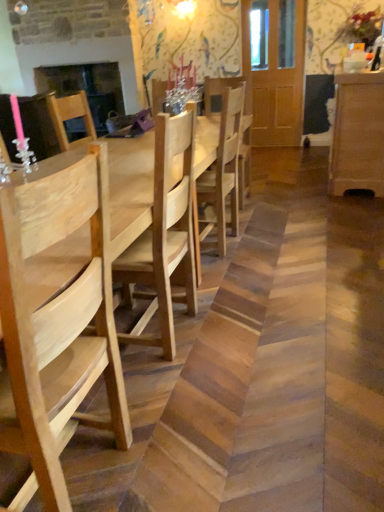
This screenshot has width=384, height=512. Describe the element at coordinates (224, 169) in the screenshot. I see `natural wood chair at center, arranged as the second chair when viewed from the left` at that location.

Image resolution: width=384 pixels, height=512 pixels. Describe the element at coordinates (86, 88) in the screenshot. I see `matte black fireplace at upper left` at that location.

Find the location of a particular element. natural wood chair at center, marked as the 1th chair in a front-to-back arrangement is located at coordinates (57, 326).

In order to click on natural wood table at center in this screenshot , I will do [130, 189].

The width and height of the screenshot is (384, 512). What do you see at coordinates (130, 189) in the screenshot? I see `natural wood table at center` at bounding box center [130, 189].

Where is `light brown wood dresser at right`? This screenshot has width=384, height=512. light brown wood dresser at right is located at coordinates (357, 134).

From the image's perspective, which one is positioned higher, light brown wood dresser at right or natural wood table at center?

light brown wood dresser at right is shown above in the image.

How many degrees apart are the facing directions of light brown wood dresser at right and natural wood table at center?

They differ by 0.306 degrees in their facing directions.

Are light brown wood dresser at right and natural wood table at center located far from each other?

Yes, light brown wood dresser at right is far from natural wood table at center.

Is light brown wood dresser at right in front of or behind natural wood table at center in the image?

Clearly, light brown wood dresser at right is behind natural wood table at center.

Looking at this image, from the image's perspective, which object appears higher, natural wood chair at center, marked as the 1th chair in a front-to-back arrangement, or light brown wood dresser at right?

light brown wood dresser at right is shown above in the image.

Is point (56, 431) behind point (358, 80)?

That is False.

Considering the positions of objects natural wood chair at center, the 2th chair when ordered from right to left, and light brown wood dresser at right in the image provided, who is more to the left, natural wood chair at center, the 2th chair when ordered from right to left, or light brown wood dresser at right?

From the viewer's perspective, natural wood chair at center, the 2th chair when ordered from right to left, appears more on the left side.

Between natural wood chair at center, the 2th chair when ordered from right to left, and light brown wood dresser at right, which one has larger size?

With larger size is light brown wood dresser at right.

Can you confirm if light brown wood dresser at right is wider than matte black fireplace at upper left?

→ Yes.

Consider the image. From the image's perspective, which is above, light brown wood dresser at right or matte black fireplace at upper left?

matte black fireplace at upper left.

Is light brown wood dresser at right aimed at matte black fireplace at upper left?

Yes, light brown wood dresser at right faces towards matte black fireplace at upper left.

Is light brown wood dresser at right in contact with matte black fireplace at upper left?

No, light brown wood dresser at right is not in contact with matte black fireplace at upper left.

Consider the image. Which of these two, natural wood chair at center, arranged as the second chair when viewed from the left, or natural wood table at center, stands taller?

Standing taller between the two is natural wood chair at center, arranged as the second chair when viewed from the left.

How many degrees apart are the facing directions of natural wood chair at center, arranged as the second chair when viewed from the left, and natural wood table at center?

natural wood chair at center, arranged as the second chair when viewed from the left, and natural wood table at center are facing 3.71 degrees away from each other.

Locate an element on the screen. table located below the natural wood chair at center, marked as the 1th chair in a back-to-front arrangement (from the image's perspective) is located at coordinates (130, 189).

Are natural wood chair at center, marked as the 1th chair in a back-to-front arrangement, and natural wood table at center far apart?

No, natural wood chair at center, marked as the 1th chair in a back-to-front arrangement, is not far from natural wood table at center.

Which object is wider, matte black fireplace at upper left or natural wood chair at center, arranged as the 1th chair when viewed from the left?

natural wood chair at center, arranged as the 1th chair when viewed from the left.

Who is taller, matte black fireplace at upper left or natural wood chair at center, arranged as the 1th chair when viewed from the left?

Standing taller between the two is matte black fireplace at upper left.

Does matte black fireplace at upper left appear on the left side of natural wood chair at center, arranged as the 1th chair when viewed from the left?

Yes, matte black fireplace at upper left is to the left of natural wood chair at center, arranged as the 1th chair when viewed from the left.

Can you tell me how much matte black fireplace at upper left and natural wood chair at center, the 2th chair when ordered from right to left, differ in facing direction?

matte black fireplace at upper left and natural wood chair at center, the 2th chair when ordered from right to left, are facing 94.2 degrees away from each other.

Consider the image. Who is bigger, matte black fireplace at upper left or light brown wood dresser at right?

With larger size is light brown wood dresser at right.

From a real-world perspective, is matte black fireplace at upper left positioned under light brown wood dresser at right based on gravity?

No.

Considering the relative sizes of matte black fireplace at upper left and light brown wood dresser at right in the image provided, is matte black fireplace at upper left thinner than light brown wood dresser at right?

Indeed, matte black fireplace at upper left has a lesser width compared to light brown wood dresser at right.

This screenshot has width=384, height=512. In the image, there is a matte black fireplace at upper left. Identify the location of table below it (from the image's perspective). (130, 189).

Looking at this image, can you confirm if natural wood table at center is shorter than matte black fireplace at upper left?

Yes.

Can you confirm if natural wood table at center is bigger than matte black fireplace at upper left?

Yes.

At what (x,y) coordinates should I click in order to perform the action: click on table located underneath the light brown wood dresser at right (from a real-world perspective). Please return your answer as a coordinate pair (x, y). This screenshot has height=512, width=384. Looking at the image, I should click on (130, 189).

At what (x,y) coordinates should I click in order to perform the action: click on chair that is the 2nd one when counting downward from the light brown wood dresser at right (from the image's perspective). Please return your answer as a coordinate pair (x, y). Looking at the image, I should click on (57, 326).

Looking at the image, which one is located further to natural wood chair at center, arranged as the second chair when viewed from the left, matte black fireplace at upper left or light brown wood dresser at right?

matte black fireplace at upper left lies further to natural wood chair at center, arranged as the second chair when viewed from the left, than the other object.

Estimate the real-world distances between objects in this image. Which object is closer to natural wood table at center, light brown wood dresser at right or natural wood chair at center, the 2th chair when ordered from right to left?

natural wood chair at center, the 2th chair when ordered from right to left, lies closer to natural wood table at center than the other object.

Which object lies further to the anchor point light brown wood dresser at right, natural wood chair at center, which appears as the 1th chair when viewed from the right, or natural wood table at center?

Among the two, natural wood table at center is located further to light brown wood dresser at right.

From the image, which object appears to be nearer to natural wood table at center, natural wood chair at center, the 2th chair when ordered from back to front, or matte black fireplace at upper left?

Among the two, natural wood chair at center, the 2th chair when ordered from back to front, is located nearer to natural wood table at center.

When comparing their distances from matte black fireplace at upper left, does natural wood table at center or natural wood chair at center, marked as the 1th chair in a front-to-back arrangement, seem further?

natural wood chair at center, marked as the 1th chair in a front-to-back arrangement, is further to matte black fireplace at upper left.

Looking at the image, which one is located closer to natural wood chair at center, which appears as the 1th chair when viewed from the right, natural wood table at center or matte black fireplace at upper left?

natural wood table at center.

Based on their spatial positions, is natural wood chair at center, arranged as the second chair when viewed from the left, or matte black fireplace at upper left further from natural wood chair at center, the 2th chair when ordered from back to front?

matte black fireplace at upper left is further to natural wood chair at center, the 2th chair when ordered from back to front.

Estimate the real-world distances between objects in this image. Which object is further from matte black fireplace at upper left, natural wood chair at center, which appears as the 1th chair when viewed from the right, or light brown wood dresser at right?

light brown wood dresser at right lies further to matte black fireplace at upper left than the other object.

Where is `dresser positioned between natural wood table at center and matte black fireplace at upper left from near to far`? dresser positioned between natural wood table at center and matte black fireplace at upper left from near to far is located at coordinates (357, 134).

At what (x,y) coordinates should I click in order to perform the action: click on chair between natural wood chair at center, the 2th chair when ordered from back to front, and matte black fireplace at upper left from front to back. Please return your answer as a coordinate pair (x, y). The width and height of the screenshot is (384, 512). Looking at the image, I should click on point(224,169).

You are a GUI agent. You are given a task and a screenshot of the screen. Output one action in this format:
    pyautogui.click(x=<x>, y=<y>)
    Task: Click on the table between natural wood chair at center, arranged as the 1th chair when viewed from the left, and matte black fireplace at upper left from front to back
    This screenshot has height=512, width=384.
    Given the screenshot: What is the action you would take?
    pyautogui.click(x=130, y=189)

The width and height of the screenshot is (384, 512). In order to click on dresser between natural wood chair at center, which appears as the 1th chair when viewed from the right, and matte black fireplace at upper left from front to back in this screenshot , I will do click(357, 134).